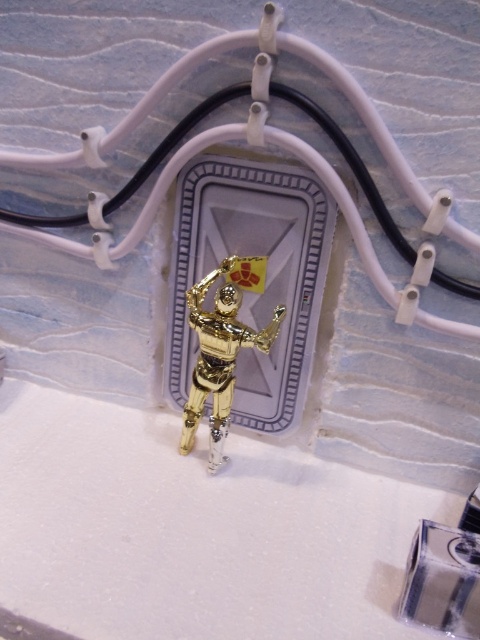
You are an engineer working on a miniature display. You need to connect the gold metallic robot at center to the black rubber wire at center using a connector that is 10 inches long. Will the connector reach?

The black rubber wire at center and gold metallic robot at center are 9.95 inches apart. The connector is 10 inches long, which is slightly longer than the distance between them. Therefore, the connector will reach.

You are an engineer inspecting a miniature model. You see the black rubber wire at center and the gold metallic robot at center. Which object is located to the right of the other?

The black rubber wire at center is positioned on the right side of gold metallic robot at center.

You are an engineer inspecting the miniature scene. You need to connect the gold metallic robot at center to a power source using the black rubber wire at center. Can you safely attach the wire to the robot without it being in the way of the flag?

The black rubber wire at center is located above the gold metallic robot at center, so attaching the wire to the robot would place it above the robot, which might interfere with the flag attached to the structure behind the robot. Ensure there is enough space between the wire and the flag to avoid obstruction.